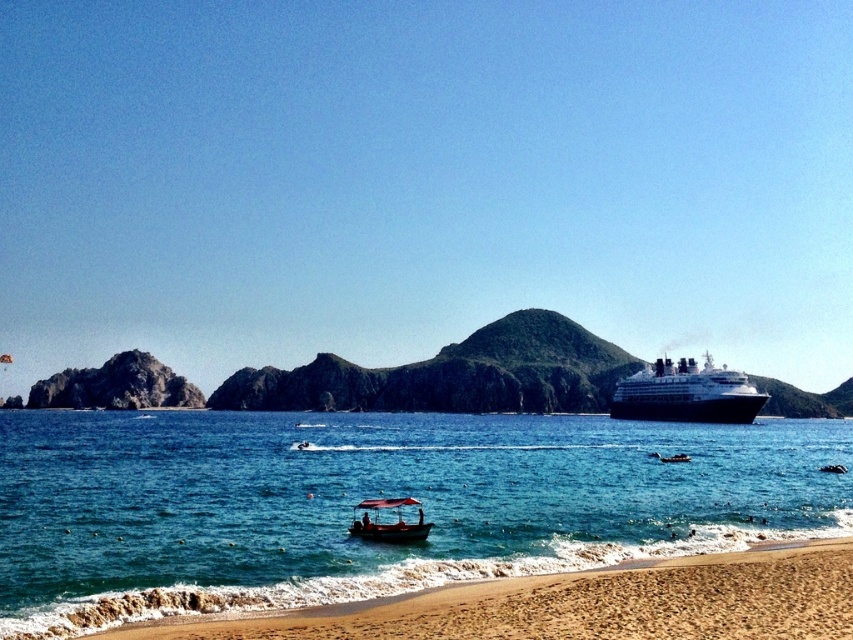
Question: Is sandy beach at lower right behind wooden boat at center?

Choices:
 (A) no
 (B) yes

Answer: (A)

Question: Considering the real-world distances, which object is closest to the sandy beach at lower right?

Choices:
 (A) wooden boat at center
 (B) clear blue water at lower center
 (C) black glossy cruise ship at right

Answer: (A)

Question: Is clear blue water at lower center positioned before black glossy cruise ship at right?

Choices:
 (A) yes
 (B) no

Answer: (A)

Question: Among these points, which one is nearest to the camera?

Choices:
 (A) (410, 531)
 (B) (677, 365)
 (C) (698, 636)

Answer: (C)

Question: Does clear blue water at lower center have a larger size compared to sandy beach at lower right?

Choices:
 (A) yes
 (B) no

Answer: (A)

Question: Estimate the real-world distances between objects in this image. Which object is closer to the clear blue water at lower center?

Choices:
 (A) black glossy cruise ship at right
 (B) sandy beach at lower right

Answer: (A)